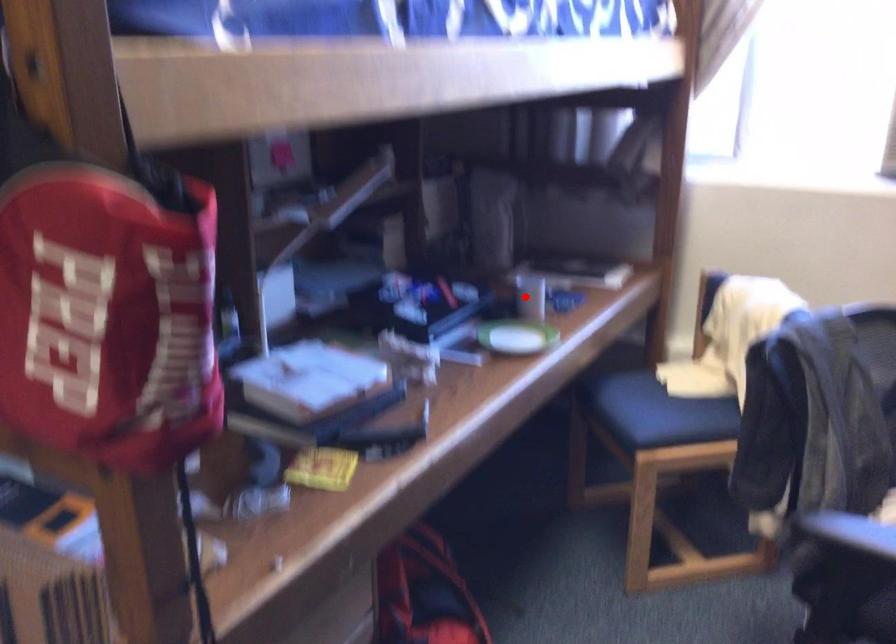
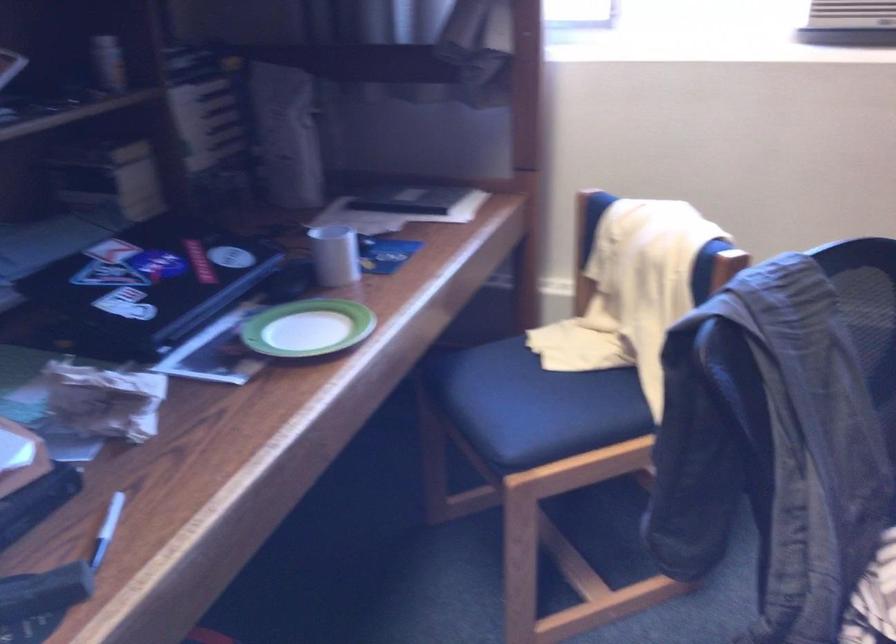
Where in the second image is the point corresponding to the highlighted location from the first image?

(334, 254)